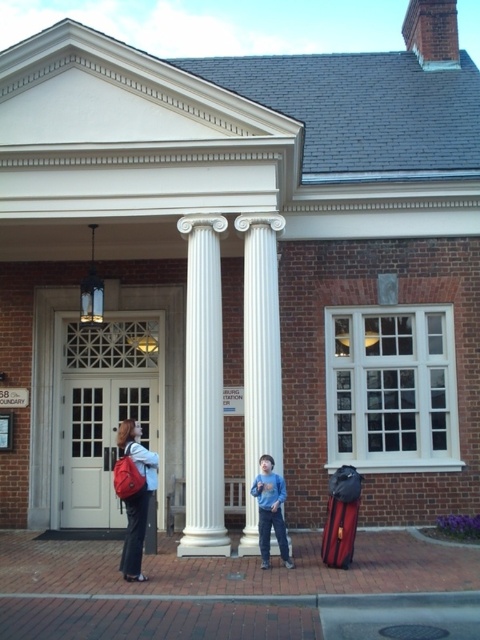
Can you confirm if white glossy column at center is thinner than matte red backpack at left?

In fact, white glossy column at center might be wider than matte red backpack at left.

Does white glossy column at center have a greater height compared to matte red backpack at left?

Yes.

Is point (190, 552) farther from camera compared to point (128, 544)?

Yes, point (190, 552) is behind point (128, 544).

This screenshot has height=640, width=480. Find the location of `white glossy column at center`. white glossy column at center is located at coordinates (204, 388).

The height and width of the screenshot is (640, 480). I want to click on white glossy column at center, so click(204, 388).

Does white glass door at center have a lesser width compared to matte red backpack at left?

Incorrect, white glass door at center's width is not less than matte red backpack at left's.

From the picture: Who is more forward, (81, 413) or (121, 564)?

Positioned in front is point (121, 564).

You are a GUI agent. You are given a task and a screenshot of the screen. Output one action in this format:
    pyautogui.click(x=<x>, y=<y>)
    Task: Click on the white glass door at center
    
    Given the screenshot: What is the action you would take?
    pyautogui.click(x=104, y=410)

Where is `white glass door at center`? The height and width of the screenshot is (640, 480). white glass door at center is located at coordinates (104, 410).